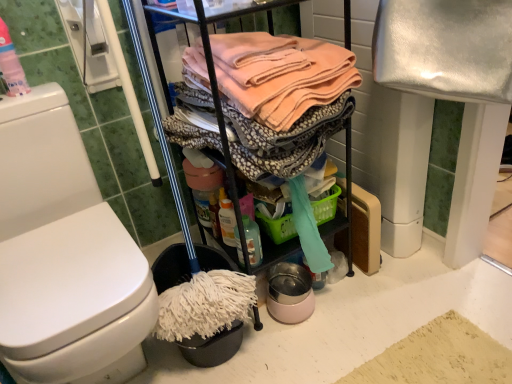
Question: Is translucent plastic spray bottle at lower center, the 2th cleaning products in the left-to-right sequence, in front of or behind soft peach fabric at center in the image?

Choices:
 (A) behind
 (B) front

Answer: (A)

Question: Is translucent plastic spray bottle at lower center, the 1th cleaning products from the right, bigger or smaller than soft peach fabric at center?

Choices:
 (A) big
 (B) small

Answer: (B)

Question: Which object is positioned closest to the soft peach fabric at center?

Choices:
 (A) white glossy toilet at left
 (B) translucent plastic bottle at upper left, which appears as the 2th cleaning products when viewed from the back
 (C) translucent plastic spray bottle at lower center, which appears as the 2th cleaning products when viewed from the top

Answer: (C)

Question: Estimate the real-world distances between objects in this image. Which object is closer to the translucent plastic bottle at upper left, the 1th cleaning products in the front-to-back sequence?

Choices:
 (A) white glossy toilet at left
 (B) translucent plastic spray bottle at lower center, which appears as the 2th cleaning products when viewed from the top
 (C) soft peach fabric at center

Answer: (A)